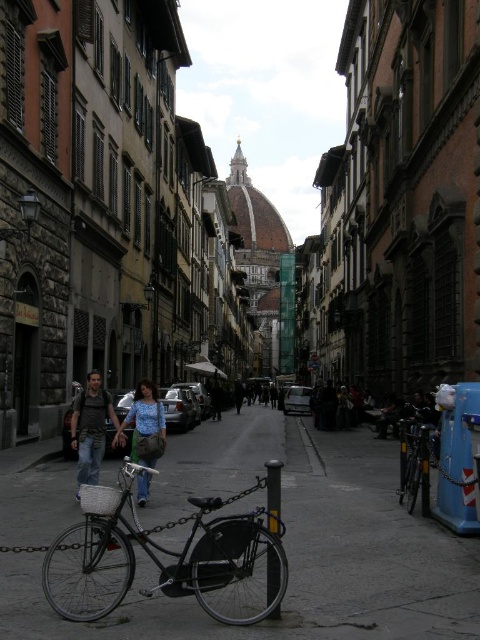
You are a tourist in Florence and want to take a photo of the Duomo di Firenze. You have a camera that requires a flat, unobstructed surface to place it on. The smooth concrete pavement at center and the shiny black bicycle at right are both in your view. Which surface would be more suitable for placing your camera?

The smooth concrete pavement at center is shorter than the shiny black bicycle at right, so the pavement is lower and might not provide a stable surface. The shiny black bicycle at right is taller, making it a better option for placing the camera as it offers a higher and possibly more stable surface.